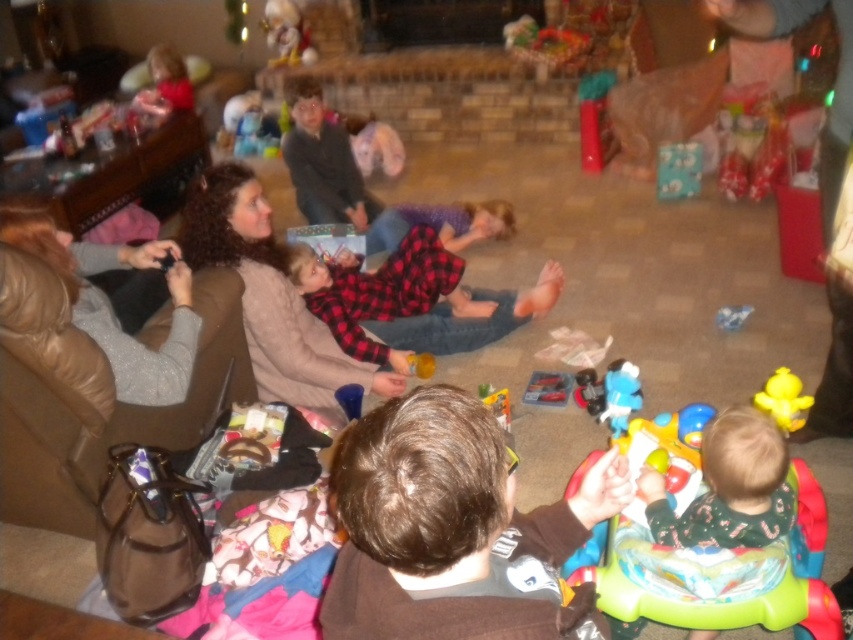
Which is in front, point (347, 332) or point (270, 17)?

Positioned in front is point (347, 332).

Between red plaid shirt at center and fluffy white teddy bear at upper center, which one is positioned lower?

red plaid shirt at center is lower down.

Is point (340, 275) in front of point (273, 28)?

Yes.

The image size is (853, 640). What are the coordinates of `red plaid shirt at center` in the screenshot? It's located at (386, 296).

At what (x,y) coordinates should I click in order to perform the action: click on light brown sweater at center. Please return your answer as a coordinate pair (x, y). Looking at the image, I should click on (270, 296).

Which is more to the left, light brown sweater at center or yellow rubber duck at lower right?

From the viewer's perspective, light brown sweater at center appears more on the left side.

Which is in front, point (231, 182) or point (759, 394)?

Positioned in front is point (759, 394).

You are a GUI agent. You are given a task and a screenshot of the screen. Output one action in this format:
    pyautogui.click(x=<x>, y=<y>)
    Task: Click on the light brown sweater at center
    The height and width of the screenshot is (640, 853).
    Given the screenshot: What is the action you would take?
    pyautogui.click(x=270, y=296)

Does plush teddy bear at upper center appear under fluffy white teddy bear at upper center?

Yes.

Does plush teddy bear at upper center appear on the right side of fluffy white teddy bear at upper center?

Incorrect, plush teddy bear at upper center is not on the right side of fluffy white teddy bear at upper center.

Describe the element at coordinates (247, 128) in the screenshot. This screenshot has width=853, height=640. I see `plush teddy bear at upper center` at that location.

The width and height of the screenshot is (853, 640). Find the location of `plush teddy bear at upper center`. plush teddy bear at upper center is located at coordinates (247, 128).